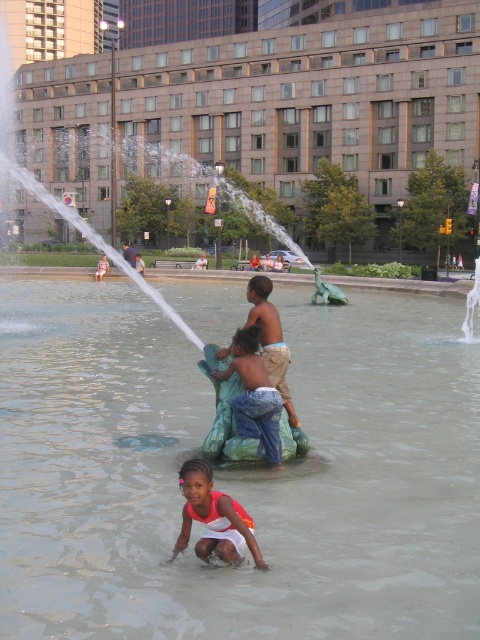
Question: Does clear water at center lie behind smooth skin child at center?

Choices:
 (A) yes
 (B) no

Answer: (B)

Question: Considering the real-world distances, which object is farthest from the white cotton dress at lower center?

Choices:
 (A) clear water at center
 (B) tan cotton shorts at center
 (C) smooth skin child at center
 (D) blue-green stone statue at center

Answer: (C)

Question: Which point is farther to the camera?

Choices:
 (A) (251, 358)
 (B) (252, 288)
 (C) (182, 524)
 (D) (432, 538)

Answer: (B)

Question: Is clear water at center to the left of smooth skin child at center from the viewer's perspective?

Choices:
 (A) no
 (B) yes

Answer: (A)

Question: Among these objects, which one is nearest to the camera?

Choices:
 (A) tan cotton shorts at center
 (B) white cotton dress at lower center

Answer: (B)

Question: Where is clear water at center located in relation to tan cotton shorts at center in the image?

Choices:
 (A) below
 (B) above

Answer: (A)